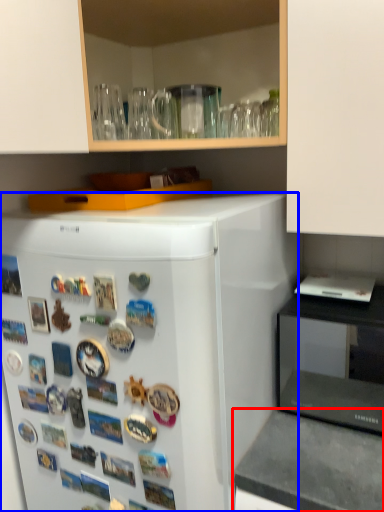
Question: Which point is closer to the camera, counter top (highlighted by a red box) or refrigerator (highlighted by a blue box)?

Choices:
 (A) counter top
 (B) refrigerator

Answer: (B)